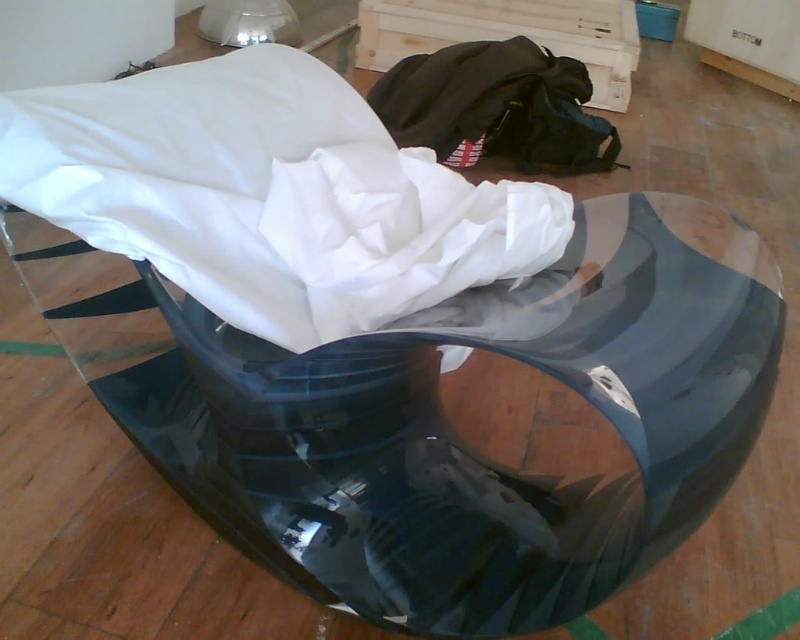
Question: Where is white fabric at center located in relation to black fabric bean bag at center in the image?

Choices:
 (A) left
 (B) right

Answer: (A)

Question: Can you confirm if transparent glossy glass table at center is positioned to the right of black fabric bean bag at center?

Choices:
 (A) yes
 (B) no

Answer: (B)

Question: Which point appears closest to the camera in this image?

Choices:
 (A) (142, 164)
 (B) (446, 106)
 (C) (466, 634)

Answer: (A)

Question: Among these objects, which one is farthest from the camera?

Choices:
 (A) white fabric at center
 (B) black fabric bean bag at center

Answer: (B)

Question: Does transparent glossy glass table at center appear on the left side of black fabric bean bag at center?

Choices:
 (A) no
 (B) yes

Answer: (B)

Question: Which object is closer to the camera taking this photo?

Choices:
 (A) white fabric at center
 (B) transparent glossy glass table at center
 (C) black fabric bean bag at center

Answer: (B)